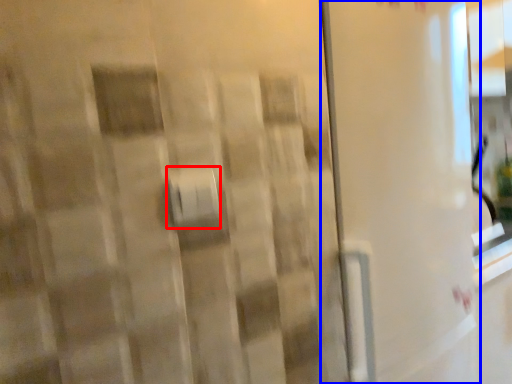
Question: Which object appears closest to the camera in this image, towel bar (highlighted by a red box) or screen door (highlighted by a blue box)?

Choices:
 (A) towel bar
 (B) screen door

Answer: (A)